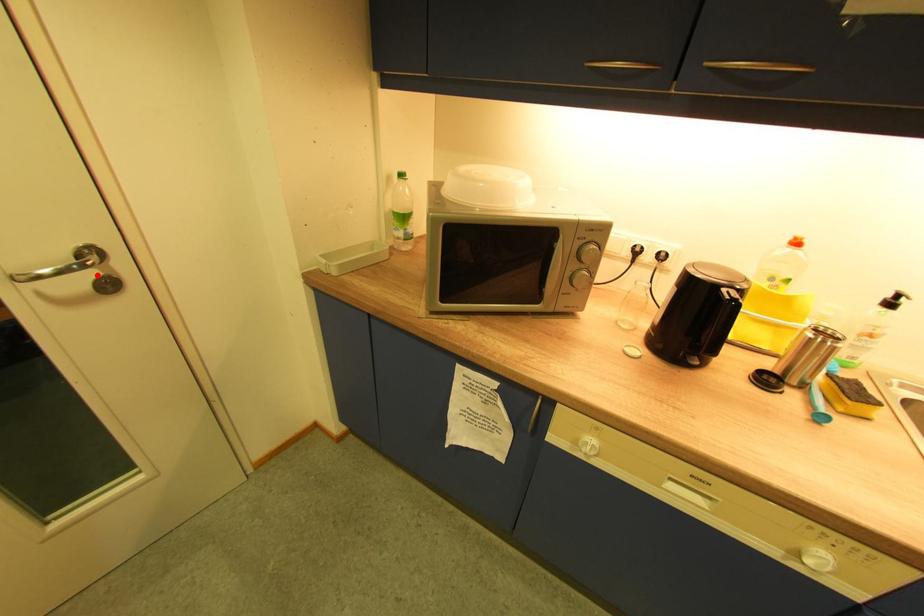
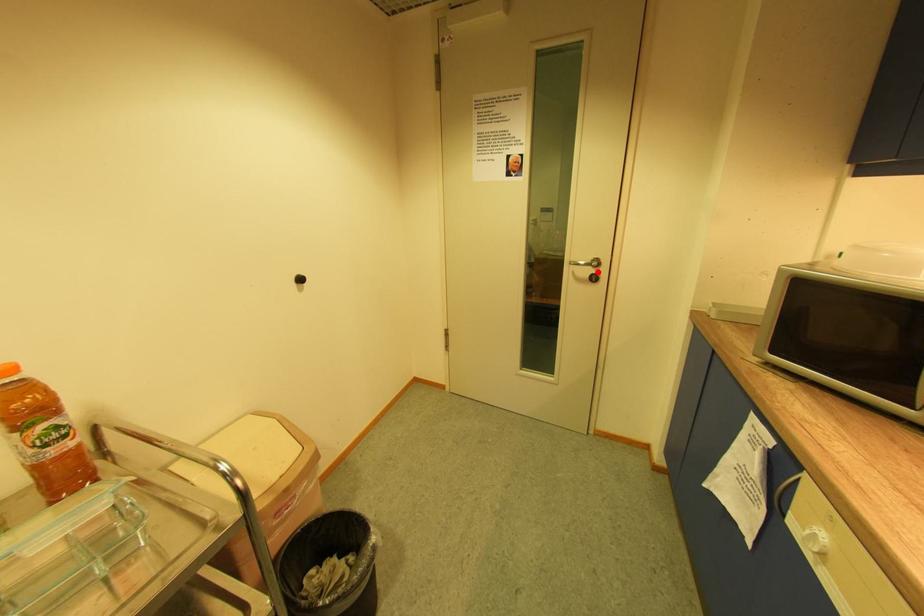
I am providing you with two images of the same scene from different viewpoints. A red point is marked on the first image and another point is marked on the second image. Are the points marked in image1 and image2 representing the same 3D position?

Yes